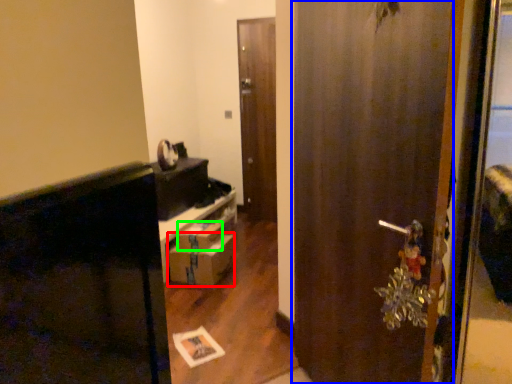
Question: Based on their relative distances, which object is farther from drawer (highlighted by a red box)? Choose from door (highlighted by a blue box) and box (highlighted by a green box).

Choices:
 (A) door
 (B) box

Answer: (A)